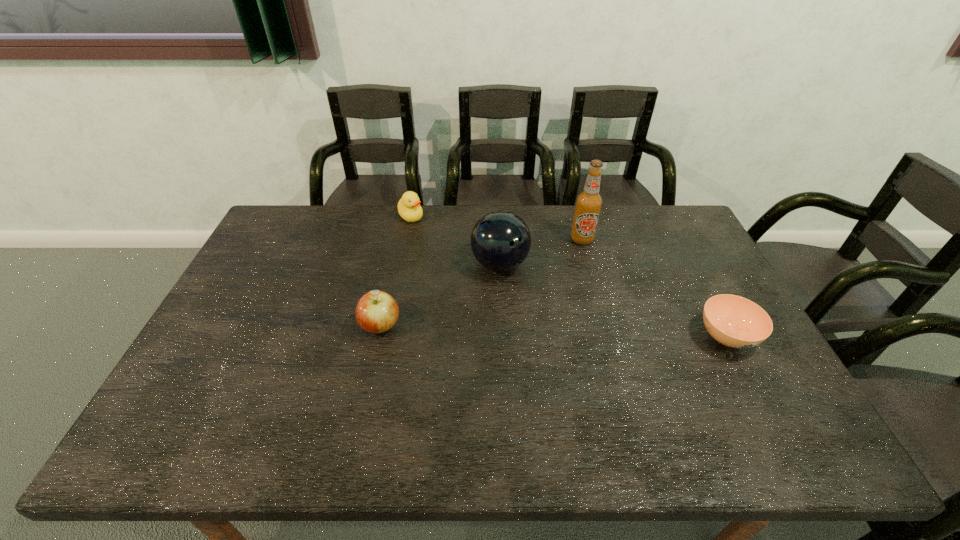
Identify the location of vacant region located 0.210m on the front label of the beer bottle. (579, 289).

What are the coordinates of `vacant space located on the front label of the beer bottle` in the screenshot? It's located at (581, 260).

Where is `free space located on the front label of the beer bottle`? free space located on the front label of the beer bottle is located at coordinates (580, 272).

Where is `blank area located on the side of the bowling ball with the finger holes`? This screenshot has height=540, width=960. blank area located on the side of the bowling ball with the finger holes is located at coordinates (564, 308).

Find the location of `vacant space situated 0.260m on the side of the bowling ball with the finger holes`. vacant space situated 0.260m on the side of the bowling ball with the finger holes is located at coordinates (589, 325).

Identify the location of free space located on the side of the bowling ball with the finger holes. The height and width of the screenshot is (540, 960). (533, 287).

I want to click on vacant area located on the face of the duckling, so click(x=437, y=247).

What are the coordinates of `vacant space situated on the face of the duckling` in the screenshot? It's located at (454, 267).

This screenshot has height=540, width=960. What are the coordinates of `free region located 0.150m on the face of the duckling` in the screenshot? It's located at (436, 246).

At what (x,y) coordinates should I click in order to perform the action: click on beer bottle situated at the far edge. Please return your answer as a coordinate pair (x, y). The height and width of the screenshot is (540, 960). Looking at the image, I should click on (589, 202).